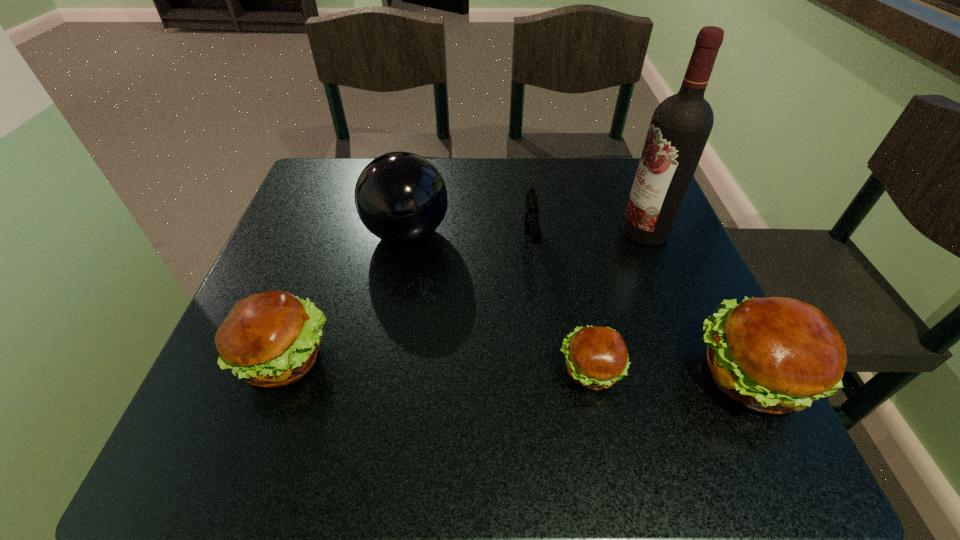
Identify the location of the leftmost hamburger. Image resolution: width=960 pixels, height=540 pixels. (270, 339).

Image resolution: width=960 pixels, height=540 pixels. I want to click on the second shortest hamburger, so click(270, 339).

This screenshot has width=960, height=540. Find the location of `the fourth object from left to right`. the fourth object from left to right is located at coordinates (597, 357).

Where is `the shortest hamburger`? the shortest hamburger is located at coordinates (597, 357).

Identify the location of the rightmost hamburger. The image size is (960, 540). (774, 355).

Locate an element on the screen. This screenshot has width=960, height=540. the fifth tallest object is located at coordinates (531, 220).

You are a GUI agent. You are given a task and a screenshot of the screen. Output one action in this format:
    pyautogui.click(x=<x>, y=<y>)
    Task: Click on the fourth object from right to left
    The width and height of the screenshot is (960, 540).
    Given the screenshot: What is the action you would take?
    coord(531,220)

This screenshot has width=960, height=540. What are the coordinates of `bowling ball` in the screenshot? It's located at (400, 197).

This screenshot has height=540, width=960. Find the location of `the tallest object`. the tallest object is located at coordinates (680, 126).

Identify the location of free space located on the right of the leftmost hamburger. (389, 357).